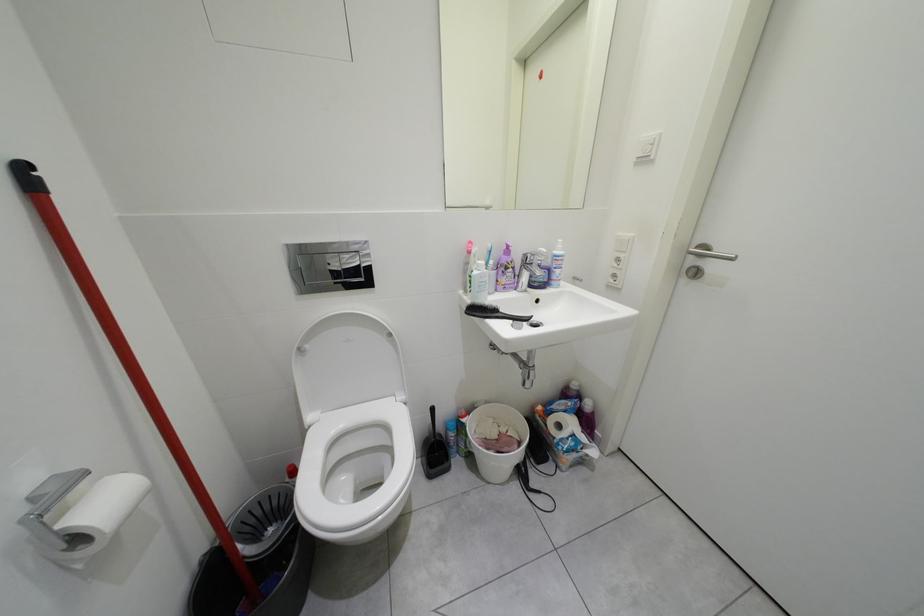
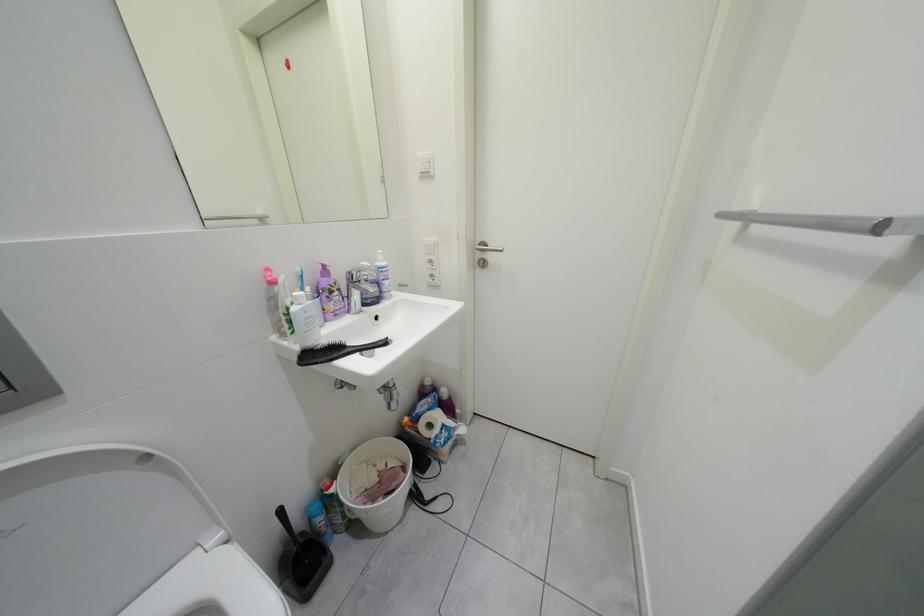
Question: The camera is either moving clockwise (left) or counter-clockwise (right) around the object. The first image is from the beginning of the video and the second image is from the end. Is the camera moving left or right when shooting the video?

Choices:
 (A) Left
 (B) Right

Answer: (A)